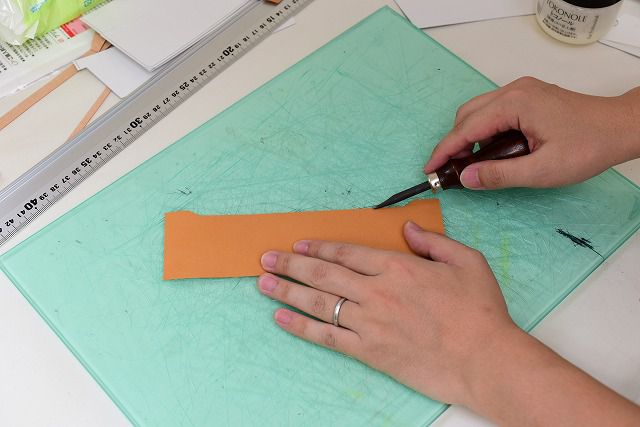
Where is `desk space to right of cutting board`? The width and height of the screenshot is (640, 427). desk space to right of cutting board is located at coordinates (527, 50).